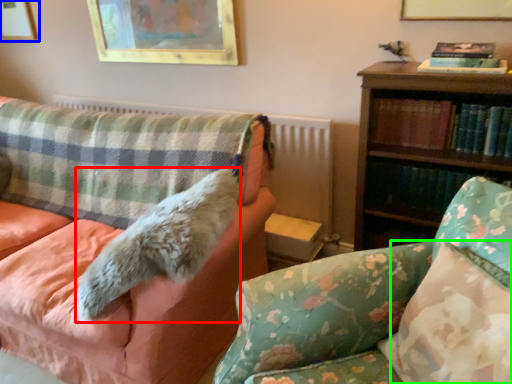
Question: Considering the real-world distances, which object is farthest from animal (highlighted by a red box)? picture frame (highlighted by a blue box) or pillow (highlighted by a green box)?

Choices:
 (A) picture frame
 (B) pillow

Answer: (A)